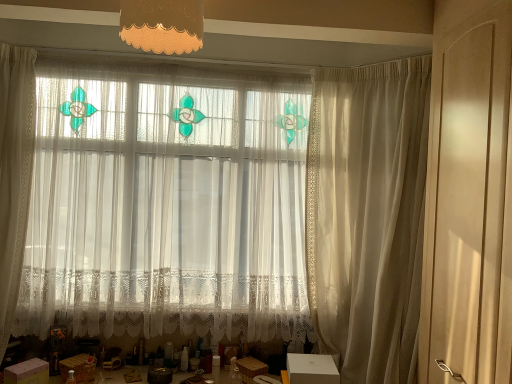
Question: Which direction should I rotate to look at matte orange fabric lampshade at upper center?

Choices:
 (A) right
 (B) left

Answer: (B)

Question: Is matte beige screen door at right located within white lace curtain at center, positioned as the 1th curtain in left-to-right order?

Choices:
 (A) no
 (B) yes

Answer: (A)

Question: Can you confirm if white lace curtain at center, which is the 2th curtain from right to left, is bigger than matte beige screen door at right?

Choices:
 (A) yes
 (B) no

Answer: (A)

Question: Could you tell me if white lace curtain at center, which is the 2th curtain from right to left, is turned towards matte beige screen door at right?

Choices:
 (A) yes
 (B) no

Answer: (A)

Question: Is the depth of white lace curtain at center, positioned as the 1th curtain in left-to-right order, greater than that of matte beige screen door at right?

Choices:
 (A) no
 (B) yes

Answer: (B)

Question: Is white lace curtain at center, which is the 2th curtain from right to left, taller than matte beige screen door at right?

Choices:
 (A) no
 (B) yes

Answer: (B)

Question: Is white lace curtain at center, which is the 2th curtain from right to left, to the left of matte beige screen door at right from the viewer's perspective?

Choices:
 (A) yes
 (B) no

Answer: (A)

Question: Is white lace curtain at center, positioned as the 1th curtain in left-to-right order, at the right side of white cardboard box at lower center, which is the first cardboard box from right to left?

Choices:
 (A) yes
 (B) no

Answer: (B)

Question: From the image's perspective, is white lace curtain at center, positioned as the 1th curtain in left-to-right order, on white cardboard box at lower center, which is the first cardboard box from right to left?

Choices:
 (A) yes
 (B) no

Answer: (A)

Question: Does white lace curtain at center, which is the 2th curtain from right to left, lie behind white cardboard box at lower center, the 3th cardboard box viewed from the left?

Choices:
 (A) no
 (B) yes

Answer: (B)

Question: Is white lace curtain at center, which is the 2th curtain from right to left, next to white cardboard box at lower center, which is the first cardboard box from right to left?

Choices:
 (A) yes
 (B) no

Answer: (B)

Question: From the image's perspective, is white lace curtain at center, positioned as the 1th curtain in left-to-right order, under white cardboard box at lower center, which is the first cardboard box from right to left?

Choices:
 (A) no
 (B) yes

Answer: (A)

Question: Is white lace curtain at center, which is the 2th curtain from right to left, outside white cardboard box at lower center, which is the first cardboard box from right to left?

Choices:
 (A) no
 (B) yes

Answer: (B)

Question: From a real-world perspective, is white cardboard box at lower left, which is the third cardboard box in right-to-left order, physically below white cardboard box at lower center, which is the first cardboard box from right to left?

Choices:
 (A) yes
 (B) no

Answer: (A)